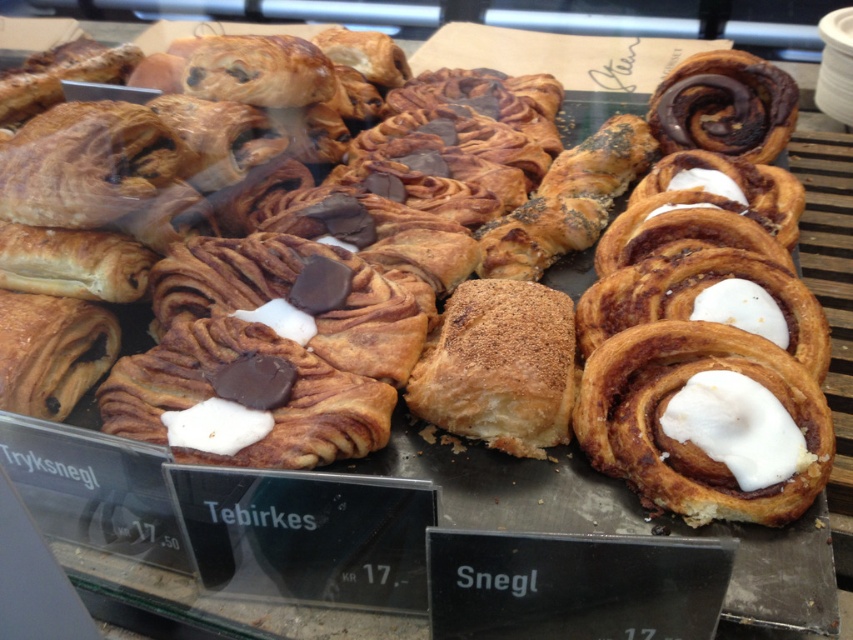
Is white glossy cinnamon roll at center to the left of chocolate chip croissant at center from the viewer's perspective?

No, white glossy cinnamon roll at center is not to the left of chocolate chip croissant at center.

Is point (672, 508) closer to camera compared to point (560, 157)?

Yes, it is.

The width and height of the screenshot is (853, 640). Identify the location of white glossy cinnamon roll at center. (689, 440).

Can you confirm if chocolate-coated pastry at center is shorter than cinnamon-sugar croissant at center?

Yes.

Is chocolate-coated pastry at center thinner than cinnamon-sugar croissant at center?

Incorrect, chocolate-coated pastry at center's width is not less than cinnamon-sugar croissant at center's.

The height and width of the screenshot is (640, 853). What do you see at coordinates (270, 410) in the screenshot?
I see `chocolate-coated pastry at center` at bounding box center [270, 410].

Locate an element on the screen. chocolate-coated pastry at center is located at coordinates coord(270,410).

Is cinnamon-sugar croissant at center above chocolate swirled bun at upper right?

Incorrect, cinnamon-sugar croissant at center is not positioned above chocolate swirled bun at upper right.

Measure the distance from cinnamon-sugar croissant at center to chocolate swirled bun at upper right.

The distance of cinnamon-sugar croissant at center from chocolate swirled bun at upper right is 31.03 inches.

At what (x,y) coordinates should I click in order to perform the action: click on cinnamon-sugar croissant at center. Please return your answer as a coordinate pair (x, y). Image resolution: width=853 pixels, height=640 pixels. Looking at the image, I should click on (498, 365).